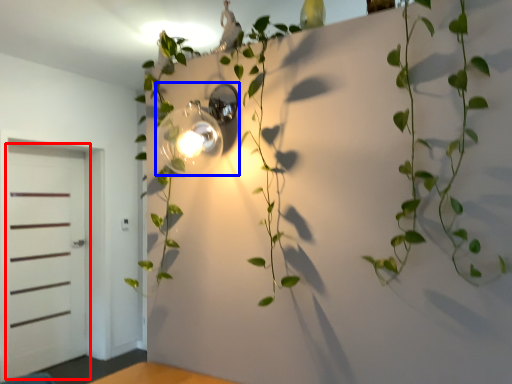
Question: Which object is further to the camera taking this photo, door (highlighted by a red box) or light fixture (highlighted by a blue box)?

Choices:
 (A) door
 (B) light fixture

Answer: (A)